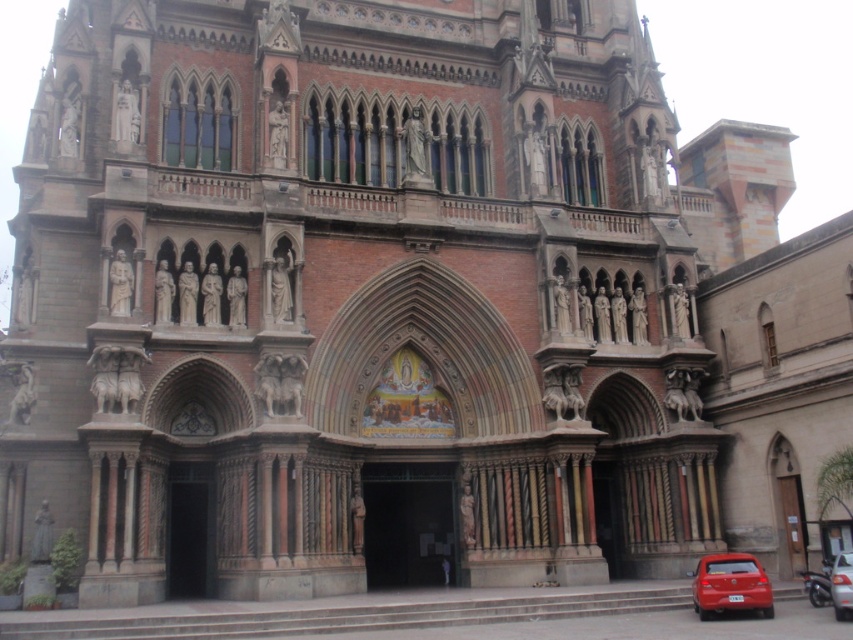
Measure the distance between metallic silver car at lower right and silver metallic car at lower right.

metallic silver car at lower right is 2.17 meters away from silver metallic car at lower right.

Can you confirm if metallic silver car at lower right is shorter than silver metallic car at lower right?

No, metallic silver car at lower right is not shorter than silver metallic car at lower right.

What are the coordinates of `metallic silver car at lower right` in the screenshot? It's located at (822, 580).

What are the coordinates of `metallic silver car at lower right` in the screenshot? It's located at pos(822,580).

Does shiny red car at lower right have a greater height compared to metallic silver car at lower right?

No, shiny red car at lower right is not taller than metallic silver car at lower right.

Which is behind, point (737, 598) or point (844, 563)?

The point (737, 598) is more distant.

Between point (701, 576) and point (819, 589), which one is positioned behind?

Positioned behind is point (819, 589).

Locate an element on the screen. shiny red car at lower right is located at coordinates (730, 584).

Does shiny red car at lower right have a lesser height compared to silver metallic car at lower right?

In fact, shiny red car at lower right may be taller than silver metallic car at lower right.

Is point (746, 595) positioned in front of point (846, 600)?

No, it is not.

Where is `shiny red car at lower right`? The image size is (853, 640). shiny red car at lower right is located at coordinates (730, 584).